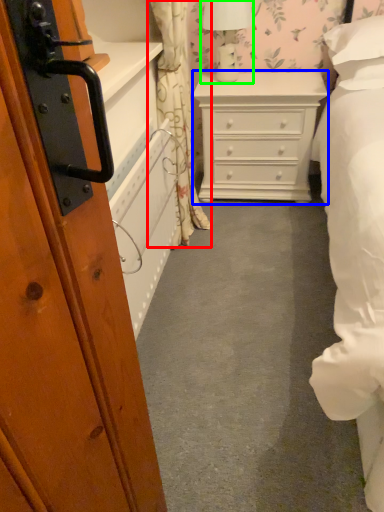
Question: Estimate the real-world distances between objects in this image. Which object is farther from curtain (highlighted by a red box), chest of drawers (highlighted by a blue box) or table lamp (highlighted by a green box)?

Choices:
 (A) chest of drawers
 (B) table lamp

Answer: (B)